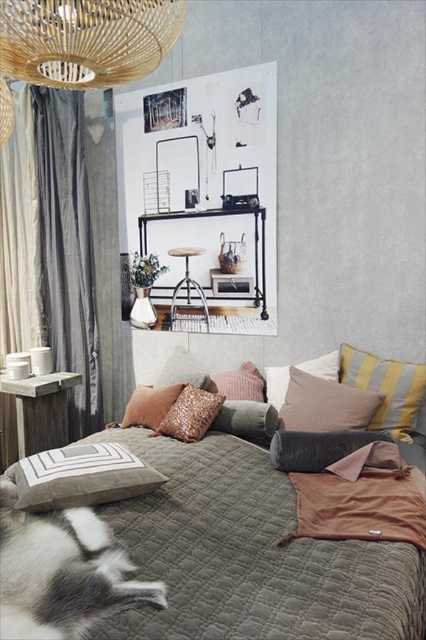
Looking at this image, you are arranging a photo shoot in the bedroom corner and need to place two pillows for a symmetric composition. The photographer wants the pillows to be mirrored around the center axis. Given the current arrangement of the textured gray pillow at center and the textured cream pillow at center, can you achieve this symmetry?

The textured gray pillow at center is positioned on the left side of the textured cream pillow at center. To create a mirrored symmetry around the center axis, the pillows would need to be placed equidistant from the center but on opposite sides. Since they are currently both at the center with the gray one on the left of the cream one, moving the gray pillow to the right side of the cream pillow would achieve symmetry.

You are a painter standing at the foot of the bed. You want to paint the bamboo chandelier at upper left and the leopard print cushion at center. How far apart are these two items from each other?

The distance between the bamboo chandelier at upper left and the leopard print cushion at center is 1.60 meters.